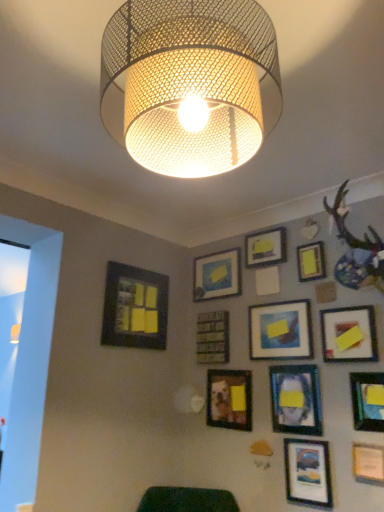
Question: Are matte black picture frame at lower right, the 8th picture frame viewed from the left, and yellow matte picture frame at upper center, positioned as the eighth picture frame in right-to-left order, located far from each other?

Choices:
 (A) no
 (B) yes

Answer: (B)

Question: From a real-world perspective, does matte black picture frame at lower right, positioned as the 5th picture frame in right-to-left order, sit lower than yellow matte picture frame at upper center, positioned as the eighth picture frame in right-to-left order?

Choices:
 (A) no
 (B) yes

Answer: (B)

Question: Considering the relative positions of matte black picture frame at lower right, positioned as the 5th picture frame in right-to-left order, and yellow matte picture frame at upper center, which appears as the fifth picture frame when viewed from the left, in the image provided, is matte black picture frame at lower right, positioned as the 5th picture frame in right-to-left order, in front of yellow matte picture frame at upper center, which appears as the fifth picture frame when viewed from the left,?

Choices:
 (A) no
 (B) yes

Answer: (B)

Question: Considering the relative positions of matte black picture frame at lower right, positioned as the 5th picture frame in right-to-left order, and yellow matte picture frame at upper center, positioned as the eighth picture frame in right-to-left order, in the image provided, is matte black picture frame at lower right, positioned as the 5th picture frame in right-to-left order, behind yellow matte picture frame at upper center, positioned as the eighth picture frame in right-to-left order,?

Choices:
 (A) yes
 (B) no

Answer: (B)

Question: Can you confirm if matte black picture frame at lower right, positioned as the 5th picture frame in right-to-left order, is bigger than yellow matte picture frame at upper center, positioned as the eighth picture frame in right-to-left order?

Choices:
 (A) yes
 (B) no

Answer: (B)

Question: Can you confirm if matte black picture frame at lower right, the 8th picture frame viewed from the left, is taller than yellow matte picture frame at upper center, which appears as the fifth picture frame when viewed from the left?

Choices:
 (A) no
 (B) yes

Answer: (B)

Question: Is matte black picture frame at lower right, the 1th picture frame viewed from the right, far away from matte black picture frame at lower left, the 1th picture frame when ordered from left to right?

Choices:
 (A) no
 (B) yes

Answer: (B)

Question: Does matte black picture frame at lower right, the 12th picture frame viewed from the left, have a greater width compared to matte black picture frame at lower left, the 1th picture frame when ordered from left to right?

Choices:
 (A) yes
 (B) no

Answer: (B)

Question: Is matte black picture frame at lower right, the 12th picture frame viewed from the left, completely or partially outside of matte black picture frame at lower left, which appears as the twelfth picture frame when viewed from the right?

Choices:
 (A) no
 (B) yes

Answer: (B)

Question: Is matte black picture frame at lower right, the 1th picture frame viewed from the right, placed right next to matte black picture frame at lower left, which appears as the twelfth picture frame when viewed from the right?

Choices:
 (A) yes
 (B) no

Answer: (B)

Question: Could you tell me if matte black picture frame at lower right, the 12th picture frame viewed from the left, is turned towards matte black picture frame at lower left, the 1th picture frame when ordered from left to right?

Choices:
 (A) yes
 (B) no

Answer: (B)

Question: Is matte black picture frame at lower right, the 12th picture frame viewed from the left, further to camera compared to matte black picture frame at lower left, the 1th picture frame when ordered from left to right?

Choices:
 (A) no
 (B) yes

Answer: (A)

Question: Can you confirm if yellow matte picture frame at upper right, acting as the 9th picture frame starting from the left, is shorter than metal mesh lampshade at upper center?

Choices:
 (A) no
 (B) yes

Answer: (B)